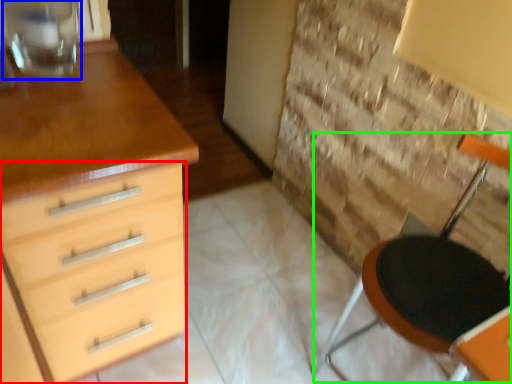
Question: Estimate the real-world distances between objects in this image. Which object is closer to chest of drawers (highlighted by a red box), glass vase (highlighted by a blue box) or armchair (highlighted by a green box)?

Choices:
 (A) glass vase
 (B) armchair

Answer: (A)